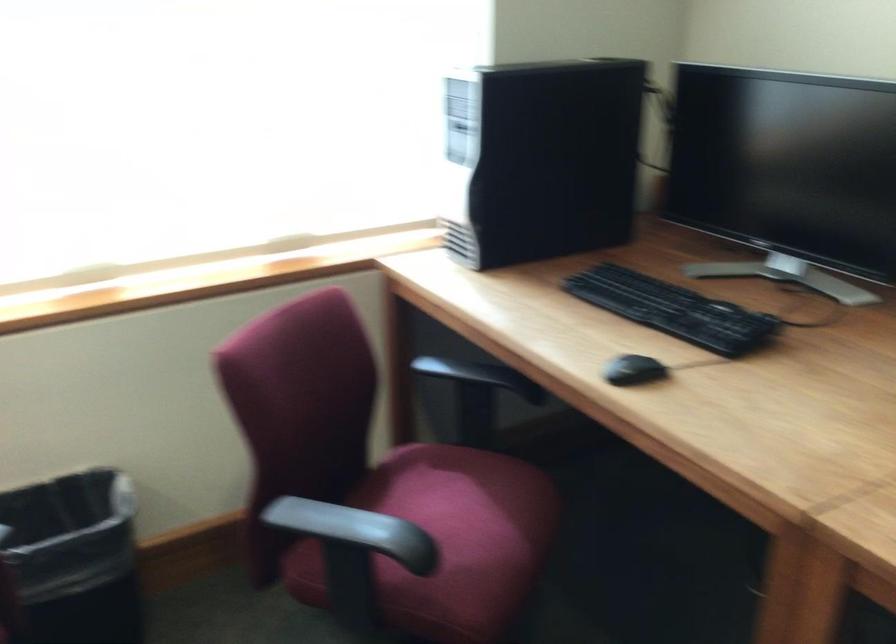
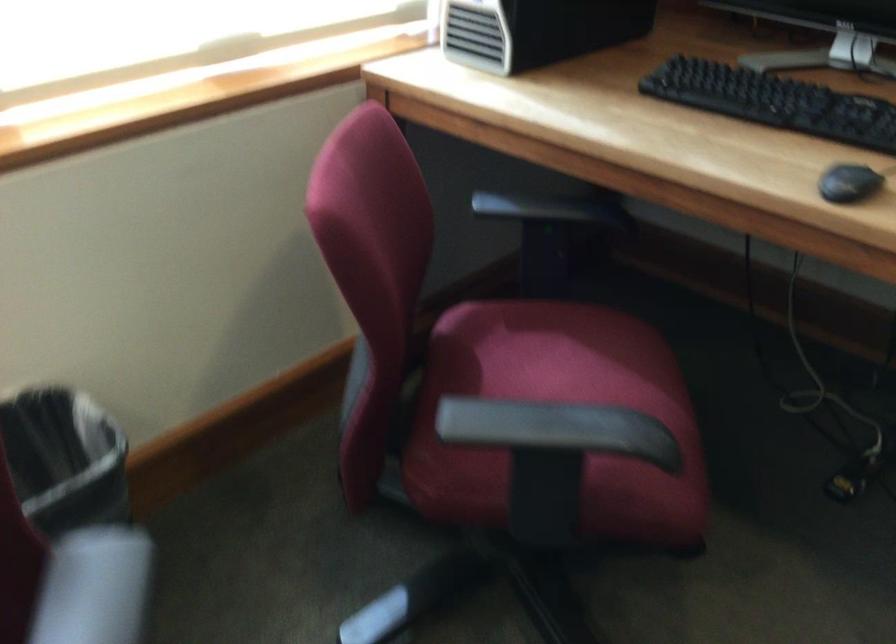
Find the pixel in the second image that matches point 469,382 in the first image.

(555, 216)